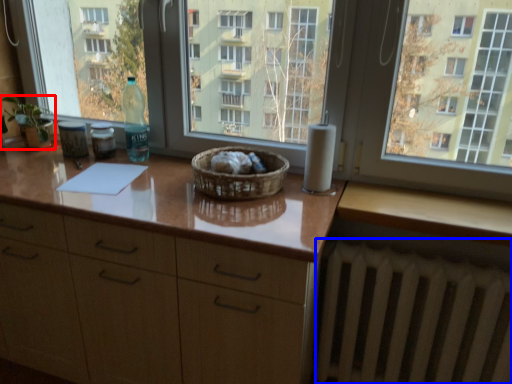
Question: Among these objects, which one is nearest to the camera, houseplant (highlighted by a red box) or radiator (highlighted by a blue box)?

Choices:
 (A) houseplant
 (B) radiator

Answer: (B)